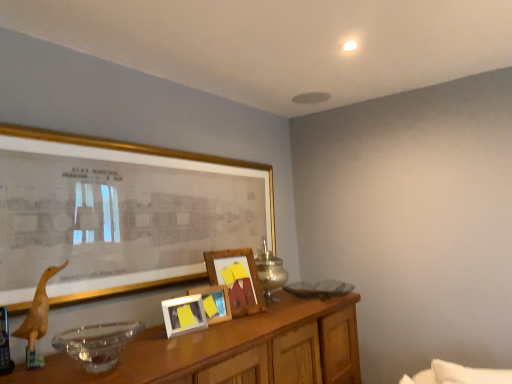
The height and width of the screenshot is (384, 512). Identify the location of vacant space to the left of matte wooden picture frame at center, which is counted as the 3th picture frame, starting from the back. (149, 327).